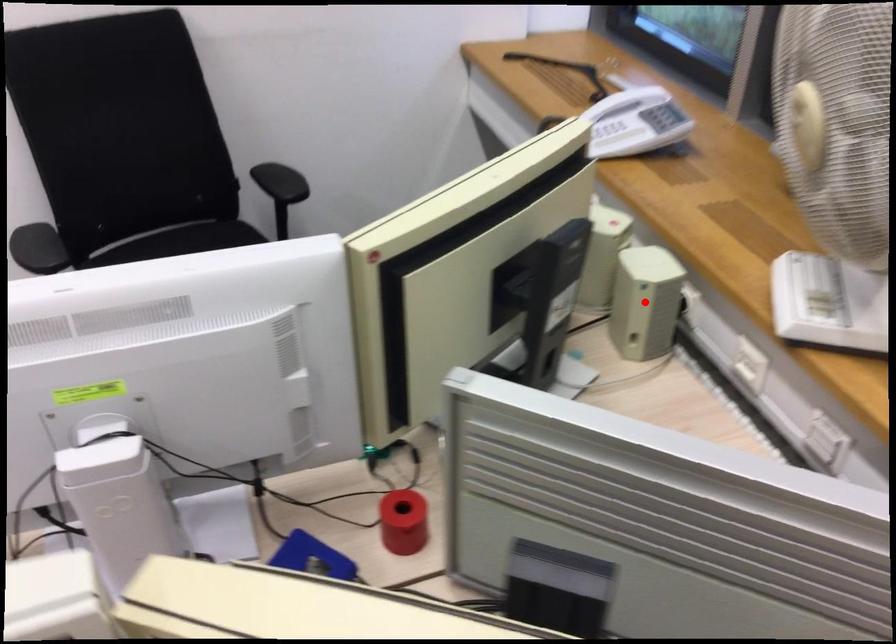
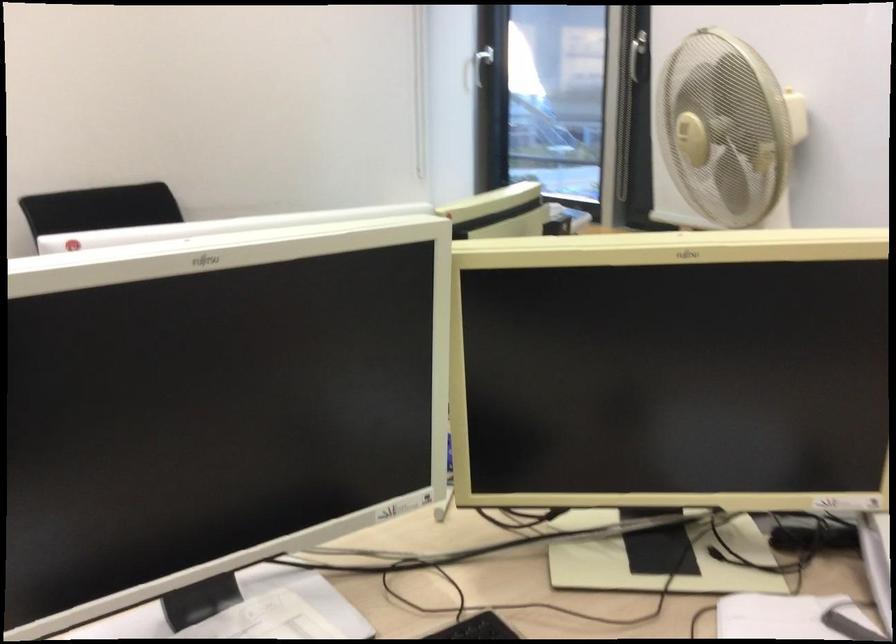
Question: I am providing you with two images of the same scene from different viewpoints. A red point is marked on the first image. Can you still see the location of the red point in image 2?

Choices:
 (A) Yes
 (B) No

Answer: (B)